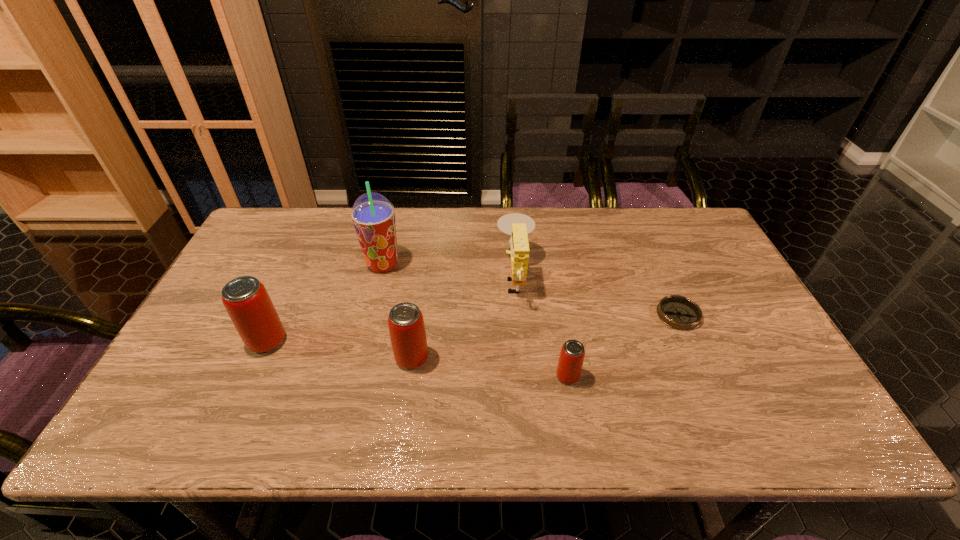
At what (x,y) coordinates should I click in order to perform the action: click on the leftmost object. Please return your answer as a coordinate pair (x, y). The image size is (960, 540). Looking at the image, I should click on (247, 302).

At what (x,y) coordinates should I click in order to perform the action: click on the third object from left to right. Please return your answer as a coordinate pair (x, y). Looking at the image, I should click on click(406, 325).

Find the location of a particular element. the second shortest beer can is located at coordinates (406, 325).

Find the location of a particular element. This screenshot has height=540, width=960. the shortest beer can is located at coordinates (571, 358).

At what (x,y) coordinates should I click in order to perform the action: click on the rightmost beer can. Please return your answer as a coordinate pair (x, y). This screenshot has width=960, height=540. Looking at the image, I should click on (571, 358).

You are a GUI agent. You are given a task and a screenshot of the screen. Output one action in this format:
    pyautogui.click(x=<x>, y=<y>)
    Task: Click on the smoothie
    
    Given the screenshot: What is the action you would take?
    pyautogui.click(x=373, y=216)

Find the location of `the fifth object from right to left`. the fifth object from right to left is located at coordinates (373, 216).

Locate an element on the screen. The width and height of the screenshot is (960, 540). the fourth object from left to right is located at coordinates (517, 225).

What are the coordinates of `the shortest object` in the screenshot? It's located at pos(678,312).

I want to click on compass, so click(x=678, y=312).